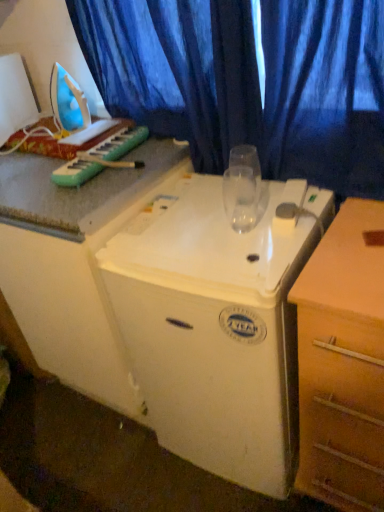
Question: Is wooden chest of drawers at right taller or shorter than white plastic refrigerator at center, the first appliance from the bottom?

Choices:
 (A) short
 (B) tall

Answer: (A)

Question: In terms of size, does wooden chest of drawers at right appear bigger or smaller than white plastic refrigerator at center, the 2th appliance from the top?

Choices:
 (A) big
 (B) small

Answer: (B)

Question: Based on their relative distances, which object is farther from the white plastic iron at left, which appears as the 1th appliance when viewed from the top?

Choices:
 (A) green plastic musical keyboard at upper left
 (B) blue fabric curtain at upper center
 (C) wooden chest of drawers at right
 (D) transparent glass at center
 (E) white plastic refrigerator at center, the first appliance in the right-to-left sequence

Answer: (C)

Question: Which object is the closest to the white plastic refrigerator at center, the first appliance from the bottom?

Choices:
 (A) green plastic musical keyboard at upper left
 (B) transparent glass at center
 (C) white plastic iron at left, which is the second appliance in right-to-left order
 (D) blue fabric curtain at upper center
 (E) wooden chest of drawers at right

Answer: (E)